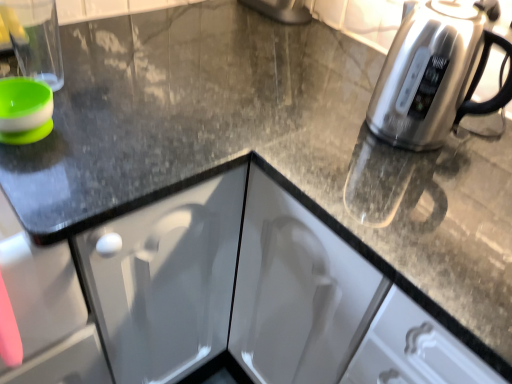
The image size is (512, 384). What do you see at coordinates (35, 38) in the screenshot?
I see `transparent plastic cup at upper left` at bounding box center [35, 38].

Locate an element on the screen. The height and width of the screenshot is (384, 512). transparent plastic cup at upper left is located at coordinates (35, 38).

The height and width of the screenshot is (384, 512). What do you see at coordinates (434, 75) in the screenshot?
I see `satin silver kettle at right` at bounding box center [434, 75].

Locate an element on the screen. Image resolution: width=512 pixels, height=384 pixels. satin silver kettle at right is located at coordinates (434, 75).

This screenshot has width=512, height=384. In order to click on transparent plastic cup at upper left in this screenshot , I will do `click(35, 38)`.

Which is more to the left, satin silver kettle at right or transparent plastic cup at upper left?

transparent plastic cup at upper left.

Is satin silver kettle at right positioned behind transparent plastic cup at upper left?

No.

Considering the positions of point (436, 136) and point (28, 76), is point (436, 136) closer or farther from the camera than point (28, 76)?

Clearly, point (436, 136) is closer to the camera than point (28, 76).

From the image's perspective, which one is positioned higher, satin silver kettle at right or transparent plastic cup at upper left?

transparent plastic cup at upper left.

From a real-world perspective, which object rests below the other?

transparent plastic cup at upper left, from a real-world perspective.

Is satin silver kettle at right thinner than transparent plastic cup at upper left?

Incorrect, the width of satin silver kettle at right is not less than that of transparent plastic cup at upper left.

Can you confirm if satin silver kettle at right is taller than transparent plastic cup at upper left?

Correct, satin silver kettle at right is much taller as transparent plastic cup at upper left.

Which of these two, satin silver kettle at right or transparent plastic cup at upper left, is bigger?

With larger size is satin silver kettle at right.

Is transparent plastic cup at upper left completely or partially inside satin silver kettle at right?

Definitely not — transparent plastic cup at upper left is not inside satin silver kettle at right.

Would you consider satin silver kettle at right to be distant from transparent plastic cup at upper left?

No.

Could you tell me if satin silver kettle at right is turned towards transparent plastic cup at upper left?

No, satin silver kettle at right is not turned towards transparent plastic cup at upper left.

Can you tell me how much satin silver kettle at right and transparent plastic cup at upper left differ in facing direction?

The angular difference between satin silver kettle at right and transparent plastic cup at upper left is 87.2 degrees.

Measure the distance between satin silver kettle at right and transparent plastic cup at upper left.

They are 27.34 inches apart.

I want to click on appliance above the satin silver kettle at right (from the image's perspective), so click(35, 38).

Would you say transparent plastic cup at upper left is to the left or to the right of satin silver kettle at right in the picture?

transparent plastic cup at upper left is positioned on satin silver kettle at right's left side.

Looking at this image, considering the relative positions of transparent plastic cup at upper left and satin silver kettle at right in the image provided, is transparent plastic cup at upper left in front of satin silver kettle at right?

No, transparent plastic cup at upper left is behind satin silver kettle at right.

Between point (49, 58) and point (476, 80), which one is positioned in front?

The point (49, 58) is closer to the camera.

From the image's perspective, does transparent plastic cup at upper left appear lower than satin silver kettle at right?

No, from the image's perspective, transparent plastic cup at upper left is not below satin silver kettle at right.

From a real-world perspective, between transparent plastic cup at upper left and satin silver kettle at right, who is vertically higher?

satin silver kettle at right, from a real-world perspective.

Looking at their sizes, would you say transparent plastic cup at upper left is wider or thinner than satin silver kettle at right?

Clearly, transparent plastic cup at upper left has less width compared to satin silver kettle at right.

Considering the relative sizes of transparent plastic cup at upper left and satin silver kettle at right in the image provided, is transparent plastic cup at upper left shorter than satin silver kettle at right?

Yes, transparent plastic cup at upper left is shorter than satin silver kettle at right.

Which of these two, transparent plastic cup at upper left or satin silver kettle at right, is smaller?

transparent plastic cup at upper left.

Choose the correct answer: Is transparent plastic cup at upper left inside satin silver kettle at right or outside it?

transparent plastic cup at upper left exists outside the volume of satin silver kettle at right.

Is transparent plastic cup at upper left placed right next to satin silver kettle at right?

transparent plastic cup at upper left is not next to satin silver kettle at right, and they're not touching.

Is transparent plastic cup at upper left oriented away from satin silver kettle at right?

transparent plastic cup at upper left is not turned away from satin silver kettle at right.

Identify the location of kettle below the transparent plastic cup at upper left (from the image's perspective). Image resolution: width=512 pixels, height=384 pixels. (434, 75).

In the image, there is a transparent plastic cup at upper left. At what (x,y) coordinates should I click in order to perform the action: click on kettle below it (from the image's perspective). Please return your answer as a coordinate pair (x, y). The height and width of the screenshot is (384, 512). Looking at the image, I should click on (434, 75).

Identify the location of appliance behind the satin silver kettle at right. The image size is (512, 384). (35, 38).